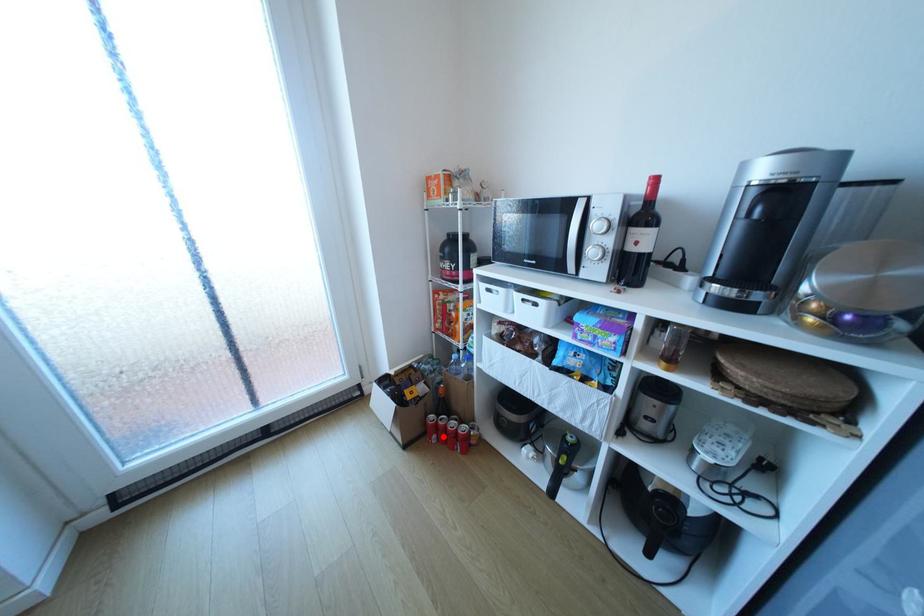
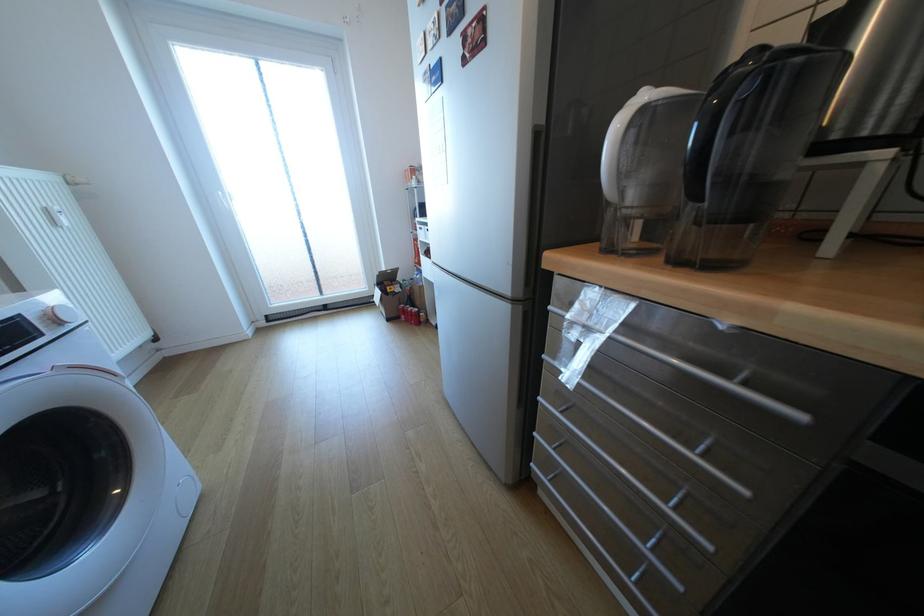
Find the pixel in the second image that matches the highlighted location in the first image.

(411, 315)